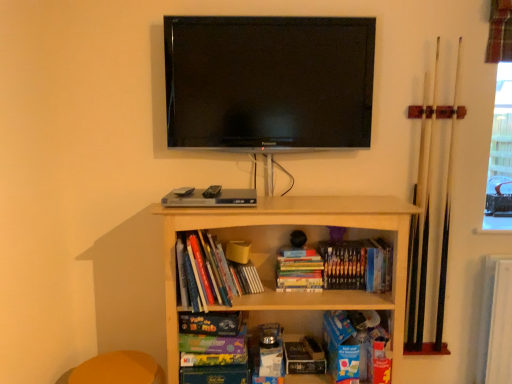
Locate an element on the screen. free location above hardcover book at center, which is counted as the third book, starting from the left (from a real-world perspective) is located at coordinates (355, 236).